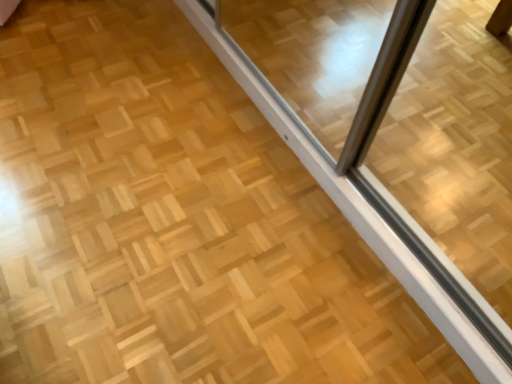
Image resolution: width=512 pixels, height=384 pixels. In order to click on transparent glass door at center in this screenshot , I will do `click(355, 207)`.

Image resolution: width=512 pixels, height=384 pixels. What do you see at coordinates (355, 207) in the screenshot?
I see `transparent glass door at center` at bounding box center [355, 207].

Identify the location of transparent glass door at center. The image size is (512, 384). (355, 207).